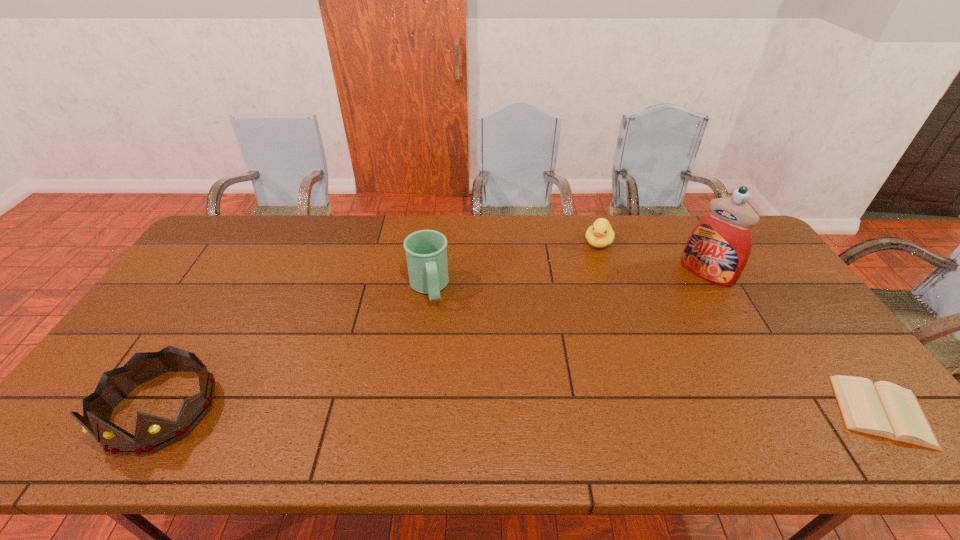
The image size is (960, 540). In order to click on free space located 0.390m on the front surface of the detergent in this screenshot , I will do `click(630, 355)`.

Locate an element on the screen. This screenshot has width=960, height=540. free space located on the front surface of the detergent is located at coordinates (684, 297).

Image resolution: width=960 pixels, height=540 pixels. Identify the location of vacant space located on the front surface of the detergent. (677, 305).

You are a GUI agent. You are given a task and a screenshot of the screen. Output one action in this format:
    pyautogui.click(x=<x>, y=<y>)
    Task: Click on the vacant space located 0.270m on the beak of the fourth tallest object
    
    Given the screenshot: What is the action you would take?
    pyautogui.click(x=572, y=303)

Find the location of `vacant space located 0.140m on the beak of the fourth tallest object`. vacant space located 0.140m on the beak of the fourth tallest object is located at coordinates (584, 277).

At what (x,y) coordinates should I click in order to perform the action: click on blank space located 0.190m on the beak of the fourth tallest object. Please return your answer as a coordinate pair (x, y). This screenshot has height=540, width=960. Looking at the image, I should click on (579, 287).

Where is `object present at the far edge`? The width and height of the screenshot is (960, 540). object present at the far edge is located at coordinates (600, 234).

This screenshot has height=540, width=960. Identify the location of object that is at the near edge. (153, 433).

Where is `object that is at the left edge`? The width and height of the screenshot is (960, 540). object that is at the left edge is located at coordinates (153, 433).

At what (x,y) coordinates should I click in order to perform the action: click on object located in the near left corner section of the desktop. Please return your answer as a coordinate pair (x, y). Looking at the image, I should click on (153, 433).